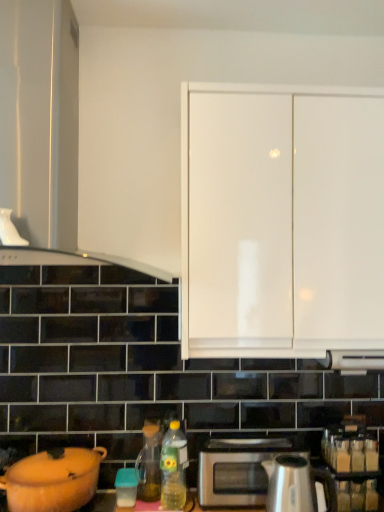
Question: Does satin silver microwave at lower center lie in front of matte glass tea pot at lower center?

Choices:
 (A) yes
 (B) no

Answer: (A)

Question: From a real-world perspective, is satin silver microwave at lower center positioned under matte glass tea pot at lower center based on gravity?

Choices:
 (A) no
 (B) yes

Answer: (B)

Question: Is satin silver microwave at lower center directly adjacent to matte glass tea pot at lower center?

Choices:
 (A) yes
 (B) no

Answer: (B)

Question: Considering the relative sizes of satin silver microwave at lower center and matte glass tea pot at lower center in the image provided, is satin silver microwave at lower center shorter than matte glass tea pot at lower center?

Choices:
 (A) no
 (B) yes

Answer: (B)

Question: From the image's perspective, is satin silver microwave at lower center on top of matte glass tea pot at lower center?

Choices:
 (A) no
 (B) yes

Answer: (A)

Question: Which is correct: polished stainless steel kettle at lower center, arranged as the second kitchen appliance when viewed from the left, is inside matte glass tea pot at lower center, or outside of it?

Choices:
 (A) inside
 (B) outside

Answer: (B)

Question: Is polished stainless steel kettle at lower center, arranged as the second kitchen appliance when viewed from the left, bigger or smaller than matte glass tea pot at lower center?

Choices:
 (A) small
 (B) big

Answer: (B)

Question: From a real-world perspective, is polished stainless steel kettle at lower center, arranged as the second kitchen appliance when viewed from the left, above or below matte glass tea pot at lower center?

Choices:
 (A) below
 (B) above

Answer: (A)

Question: Considering the relative positions of polished stainless steel kettle at lower center, arranged as the second kitchen appliance when viewed from the left, and matte glass tea pot at lower center in the image provided, is polished stainless steel kettle at lower center, arranged as the second kitchen appliance when viewed from the left, to the left or to the right of matte glass tea pot at lower center?

Choices:
 (A) right
 (B) left

Answer: (A)

Question: From the image's perspective, is matte orange pot at lower left, acting as the 1th kitchen appliance starting from the left, above or below white glossy cabinet doors at upper center, which is counted as the first cabinetry, starting from the right?

Choices:
 (A) below
 (B) above

Answer: (A)

Question: Based on their sizes in the image, would you say matte orange pot at lower left, the second kitchen appliance in the right-to-left sequence, is bigger or smaller than white glossy cabinet doors at upper center, acting as the second cabinetry starting from the left?

Choices:
 (A) small
 (B) big

Answer: (A)

Question: Does point (x=8, y=471) appear closer or farther from the camera than point (x=324, y=98)?

Choices:
 (A) closer
 (B) farther

Answer: (B)

Question: From a real-world perspective, is matte orange pot at lower left, the second kitchen appliance in the right-to-left sequence, above or below white glossy cabinet doors at upper center, which is counted as the first cabinetry, starting from the right?

Choices:
 (A) above
 (B) below

Answer: (B)

Question: In terms of width, does matte orange pot at lower left, the second kitchen appliance in the right-to-left sequence, look wider or thinner when compared to matte glass tea pot at lower center?

Choices:
 (A) wide
 (B) thin

Answer: (A)

Question: Considering the positions of matte orange pot at lower left, acting as the 1th kitchen appliance starting from the left, and matte glass tea pot at lower center in the image, is matte orange pot at lower left, acting as the 1th kitchen appliance starting from the left, bigger or smaller than matte glass tea pot at lower center?

Choices:
 (A) big
 (B) small

Answer: (A)